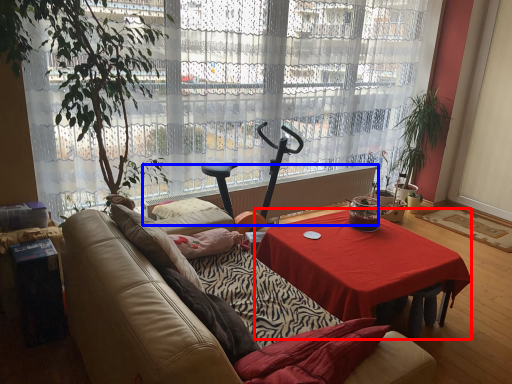
Question: Which point is further to the camera, desk (highlighted by a red box) or radiator (highlighted by a blue box)?

Choices:
 (A) desk
 (B) radiator

Answer: (B)